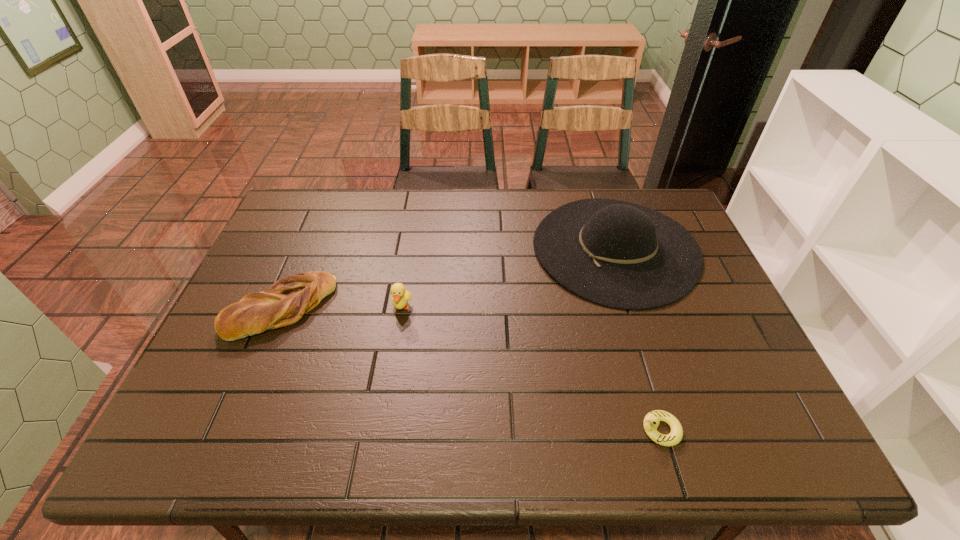
Locate an element on the screen. This screenshot has width=960, height=540. free space that is in between the farther duckling and the tallest object is located at coordinates (509, 278).

The image size is (960, 540). I want to click on empty space that is in between the sombrero and the taller duckling, so click(509, 278).

Where is `unoccupied position between the bread and the sombrero`? The image size is (960, 540). unoccupied position between the bread and the sombrero is located at coordinates (448, 278).

You are a GUI agent. You are given a task and a screenshot of the screen. Output one action in this format:
    pyautogui.click(x=<x>, y=<y>)
    Task: Click on the vacant area that lies between the second tallest object and the tallest object
    
    Given the screenshot: What is the action you would take?
    pyautogui.click(x=509, y=278)

Where is `empty space that is in between the farther duckling and the shortest object`? empty space that is in between the farther duckling and the shortest object is located at coordinates pyautogui.click(x=531, y=368).

At what (x,y) coordinates should I click in order to perform the action: click on vacant area between the sombrero and the shortest object. Please return your answer as a coordinate pair (x, y). Looking at the image, I should click on (637, 339).

Where is `object that is the third closest one to the leftmost object`? The height and width of the screenshot is (540, 960). object that is the third closest one to the leftmost object is located at coordinates (651, 421).

Identify the location of object identified as the third closest to the right duckling. (288, 299).